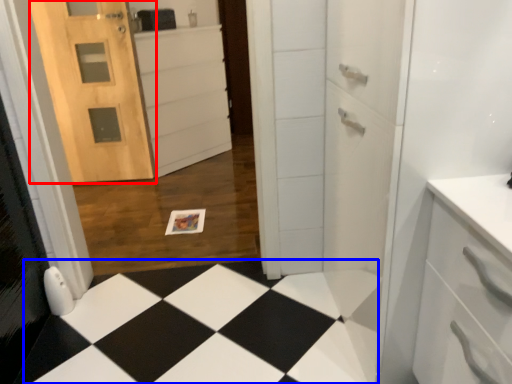
Question: Which of the following is the farthest to the observer, door (highlighted by a red box) or square (highlighted by a blue box)?

Choices:
 (A) door
 (B) square

Answer: (A)